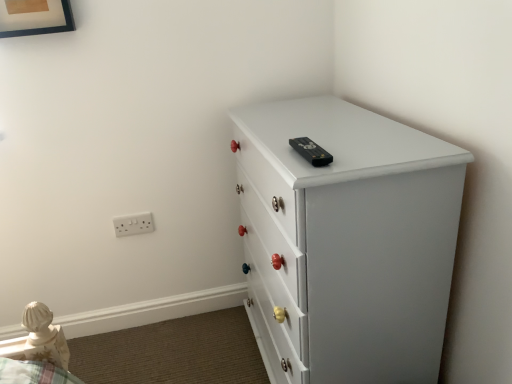
You are a GUI agent. You are given a task and a screenshot of the screen. Output one action in this format:
    pyautogui.click(x=<x>, y=<y>)
    Task: Click on the free spot above white painted wood chest of drawers at upper right (from a real-world perspective)
    This screenshot has width=512, height=384.
    Given the screenshot: What is the action you would take?
    pyautogui.click(x=327, y=123)